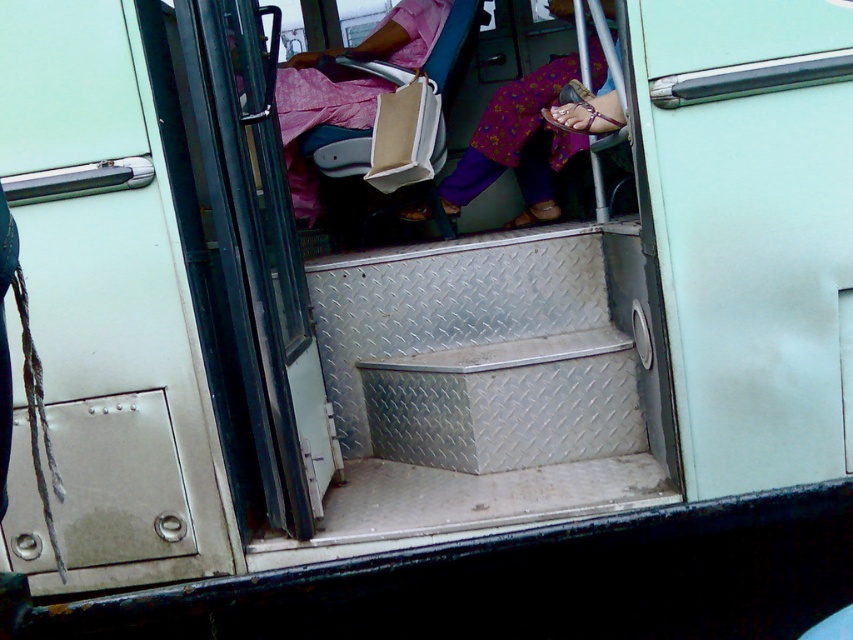
You are a person carrying a large box that is wider than the diamond plate metal stairs at center. You need to enter the bus through the open door. Can you pass through the area near the floral fabric dress at center without the box getting stuck?

The diamond plate metal stairs at center is wider than the floral fabric dress at center. Since your box is wider than the stairs, it will also be wider than the dress, so the box may get stuck when passing through the area near the floral fabric dress at center.

In the scene shown: You are standing at the entrance of the bus and want to step onto the diamond plate metal stairs at center. Based on the coordinates provided, where exactly should you position your foot to step onto the stairs?

The diamond plate metal stairs at center are located at coordinates point (479, 387), so you should position your foot at that exact point to step onto the stairs.